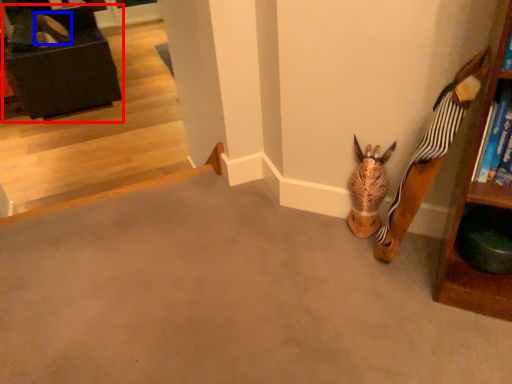
Question: Which point is closer to the camera, furniture (highlighted by a red box) or shoe (highlighted by a blue box)?

Choices:
 (A) furniture
 (B) shoe

Answer: (A)